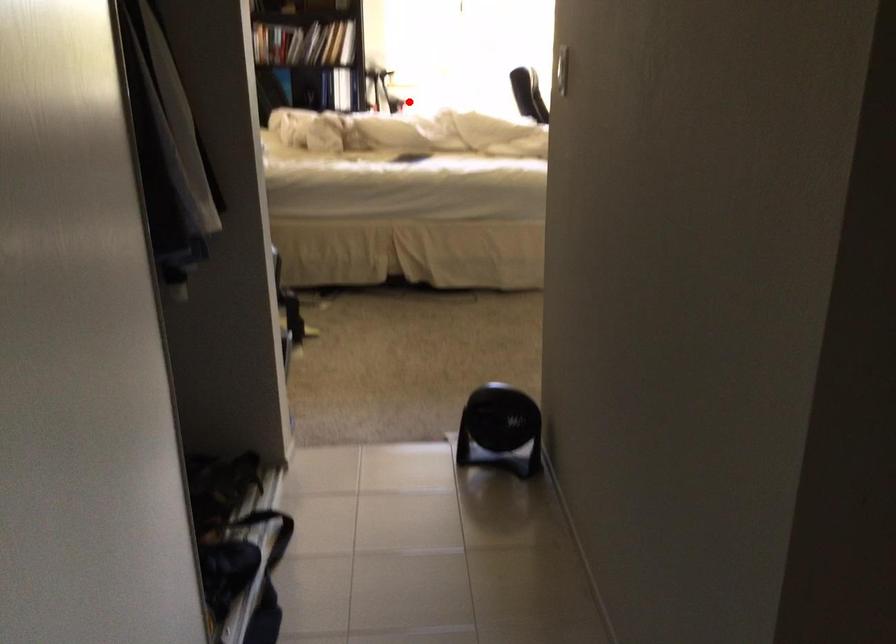
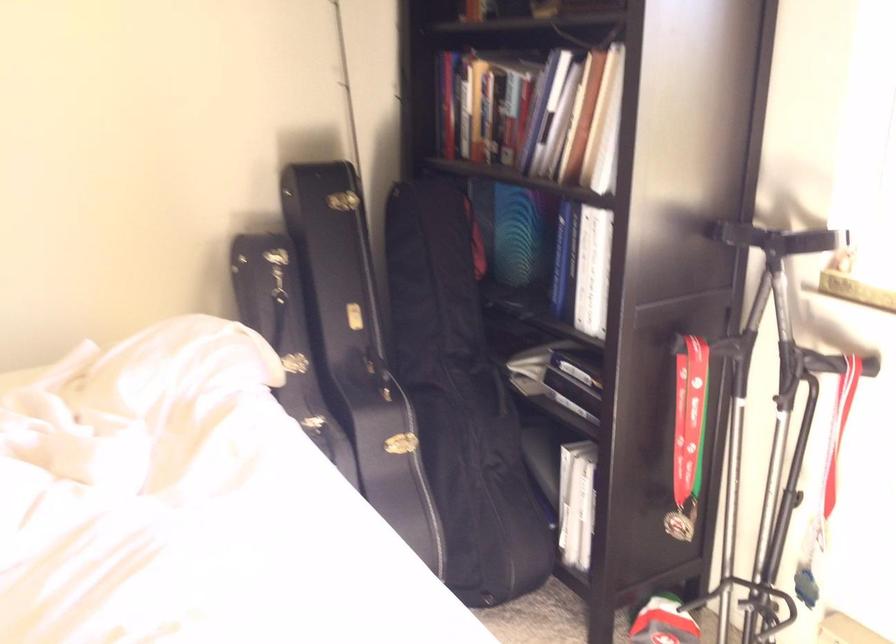
Question: I am providing you with two images of the same scene from different viewpoints. In image1, a red point is highlighted. Considering the same 3D point in image2, which of the following is correct?

Choices:
 (A) It is closer
 (B) It is farther

Answer: (A)